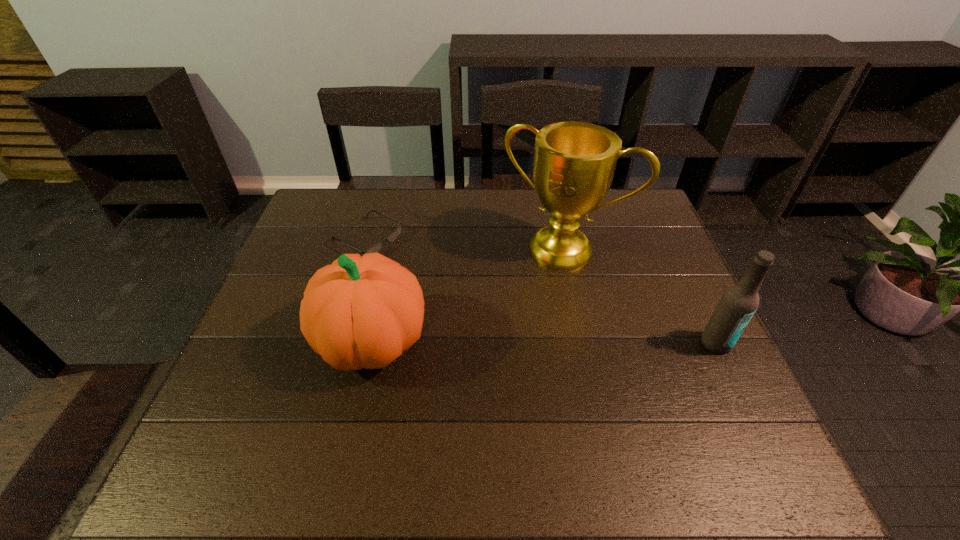
You are a GUI agent. You are given a task and a screenshot of the screen. Output one action in this format:
    pyautogui.click(x=<x>, y=<y>)
    Task: Click on the object that is positioned at the far right corner
    The width and height of the screenshot is (960, 540).
    Given the screenshot: What is the action you would take?
    pyautogui.click(x=574, y=163)

This screenshot has width=960, height=540. What are the coordinates of `vacant space at the far edge` in the screenshot? It's located at (522, 190).

In the image, there is a desktop. Identify the location of vacant space at the near edge. Image resolution: width=960 pixels, height=540 pixels. (633, 408).

The width and height of the screenshot is (960, 540). Identify the location of vacant space at the left edge of the desktop. (271, 349).

This screenshot has height=540, width=960. I want to click on free space at the right edge, so click(641, 279).

Find the location of `vacant space at the far left corner of the desktop`. vacant space at the far left corner of the desktop is located at coordinates (335, 213).

Identify the location of blank space at the near left corner of the desktop. (276, 411).

In order to click on vacant point located between the pumpkin and the award in this screenshot , I will do `click(468, 295)`.

Find the location of a particular element. The width and height of the screenshot is (960, 540). vacant space that is in between the tallest object and the rightmost object is located at coordinates (639, 296).

You are a GUI agent. You are given a task and a screenshot of the screen. Output one action in this format:
    pyautogui.click(x=<x>, y=<y>)
    Task: Click on the empty location between the beer bottle and the pumpkin
    The image size is (960, 540).
    Given the screenshot: What is the action you would take?
    pyautogui.click(x=544, y=342)